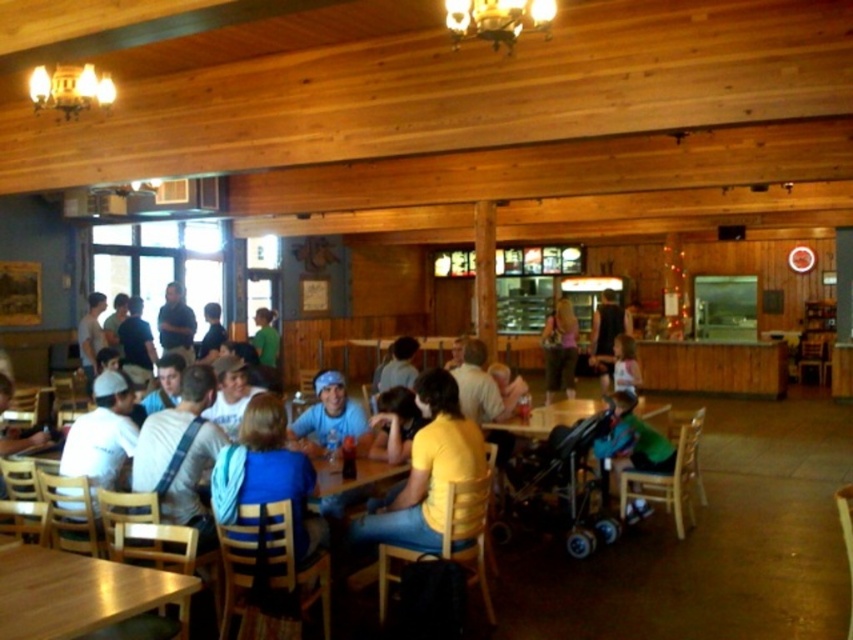
Who is shorter, white matte shirt at left or light blue denim shirt at center?

white matte shirt at left

Is white matte shirt at left thinner than light blue denim shirt at center?

Yes.

Between point (103, 442) and point (573, 323), which one is positioned behind?

The point (573, 323) is behind.

The image size is (853, 640). Identify the location of white matte shirt at left. (102, 433).

Who is more distant from viewer, (607, 332) or (258, 321)?

Point (607, 332)

What do you see at coordinates (606, 337) in the screenshot? I see `dark blue shirt at center` at bounding box center [606, 337].

The height and width of the screenshot is (640, 853). In order to click on dark blue shirt at center in this screenshot , I will do `click(606, 337)`.

Does light brown wood table at lower left have a greater height compared to blue fabric scarf at center?

Incorrect, light brown wood table at lower left's height is not larger of blue fabric scarf at center's.

Image resolution: width=853 pixels, height=640 pixels. What do you see at coordinates (78, 593) in the screenshot? I see `light brown wood table at lower left` at bounding box center [78, 593].

What are the coordinates of `light brown wood table at lower left` in the screenshot? It's located at (78, 593).